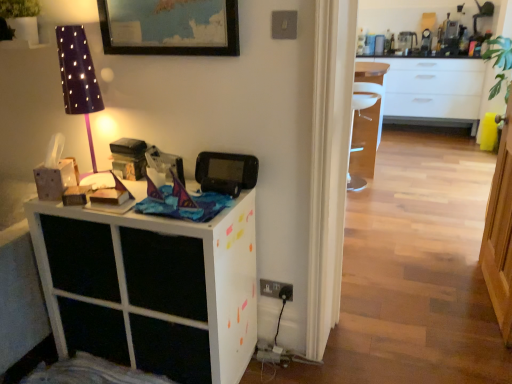
Question: From the image's perspective, is black plastic game console at upper center over purple dotted fabric lampshade at upper left?

Choices:
 (A) no
 (B) yes

Answer: (A)

Question: Is black plastic game console at upper center taller than purple dotted fabric lampshade at upper left?

Choices:
 (A) no
 (B) yes

Answer: (A)

Question: Is black plastic game console at upper center positioned in front of purple dotted fabric lampshade at upper left?

Choices:
 (A) no
 (B) yes

Answer: (A)

Question: From the image's perspective, is black plastic game console at upper center below purple dotted fabric lampshade at upper left?

Choices:
 (A) no
 (B) yes

Answer: (B)

Question: Is black plastic game console at upper center directly adjacent to purple dotted fabric lampshade at upper left?

Choices:
 (A) yes
 (B) no

Answer: (B)

Question: Is black plastic game console at upper center to the left or to the right of white matte cabinet at left in the image?

Choices:
 (A) left
 (B) right

Answer: (B)

Question: Is point (224, 162) closer or farther from the camera than point (89, 238)?

Choices:
 (A) farther
 (B) closer

Answer: (A)

Question: From a real-world perspective, is black plastic game console at upper center positioned above or below white matte cabinet at left?

Choices:
 (A) above
 (B) below

Answer: (A)

Question: From the image's perspective, is black plastic game console at upper center above or below white matte cabinet at left?

Choices:
 (A) above
 (B) below

Answer: (A)

Question: Based on their sizes in the image, would you say purple dotted fabric lampshade at upper left is bigger or smaller than black plastic game console at upper center?

Choices:
 (A) big
 (B) small

Answer: (A)

Question: Considering the positions of point (86, 54) and point (202, 185), is point (86, 54) closer or farther from the camera than point (202, 185)?

Choices:
 (A) farther
 (B) closer

Answer: (A)

Question: Is purple dotted fabric lampshade at upper left wider or thinner than black plastic game console at upper center?

Choices:
 (A) wide
 (B) thin

Answer: (A)

Question: From the image's perspective, is purple dotted fabric lampshade at upper left positioned above or below black plastic game console at upper center?

Choices:
 (A) above
 (B) below

Answer: (A)

Question: From a real-world perspective, relative to white matte cabinet at left, is purple dotted fabric lampshade at upper left vertically above or below?

Choices:
 (A) below
 (B) above

Answer: (B)

Question: In the image, is purple dotted fabric lampshade at upper left on the left side or the right side of white matte cabinet at left?

Choices:
 (A) right
 (B) left

Answer: (B)